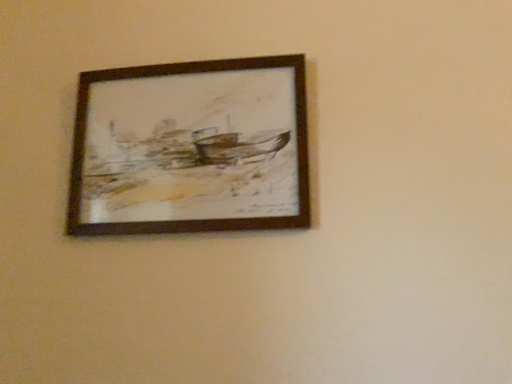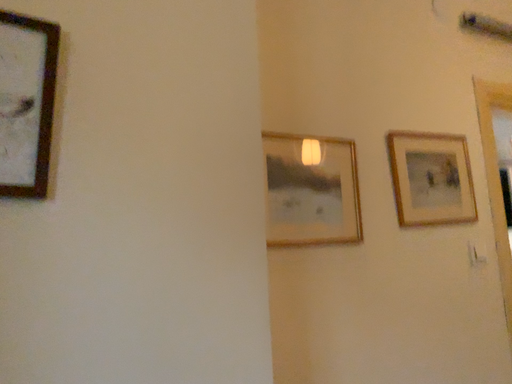
Question: How did the camera likely rotate when shooting the video?

Choices:
 (A) rotated upward
 (B) rotated downward

Answer: (B)